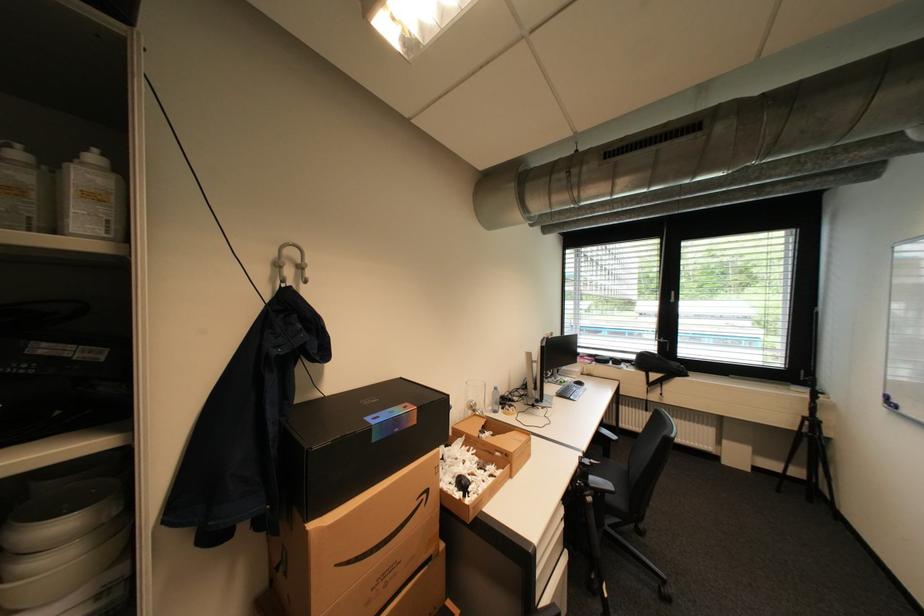
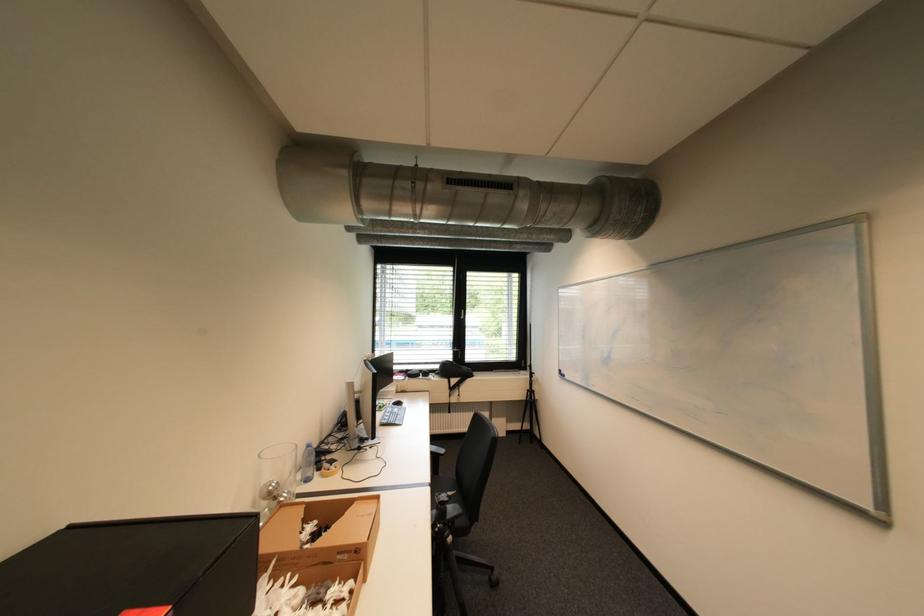
Question: The first image is from the beginning of the video and the second image is from the end. How did the camera likely rotate when shooting the video?

Choices:
 (A) Left
 (B) Right
 (C) Up
 (D) Down

Answer: (B)